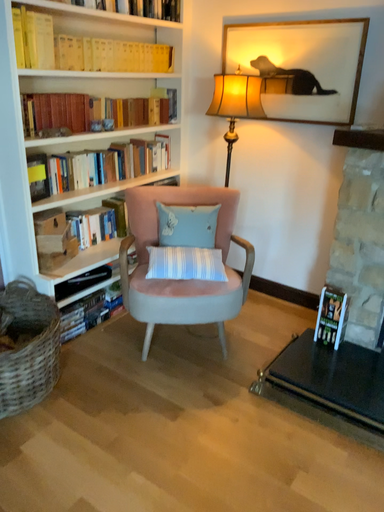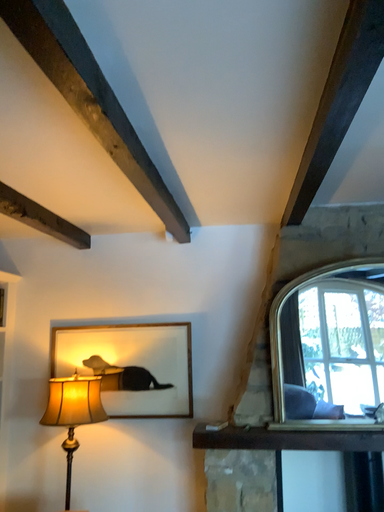
Question: Which way did the camera rotate in the video?

Choices:
 (A) rotated downward
 (B) rotated upward

Answer: (B)